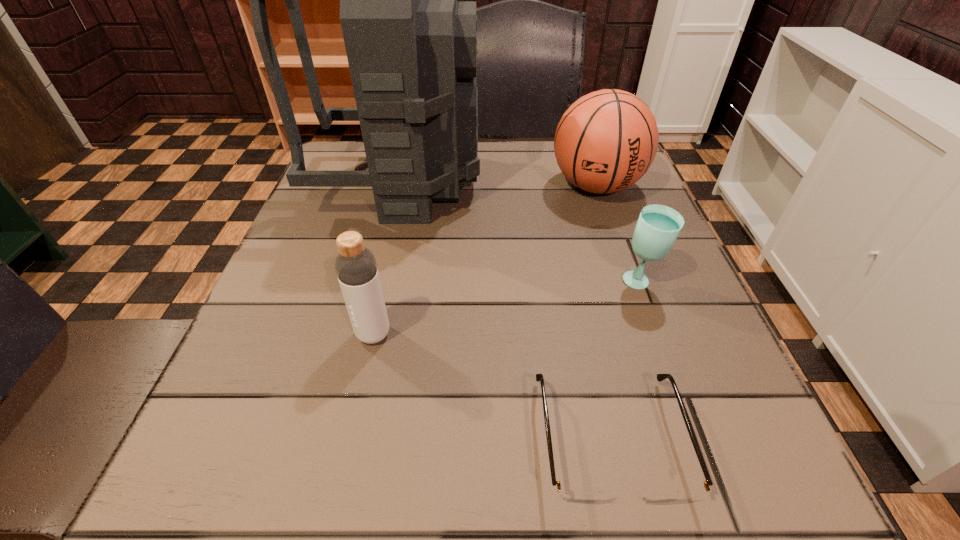
Find the location of `vacant space located 0.140m on the back of the second shortest object`. vacant space located 0.140m on the back of the second shortest object is located at coordinates (618, 222).

You are a GUI agent. You are given a task and a screenshot of the screen. Output one action in this format:
    pyautogui.click(x=<x>, y=<y>)
    Task: Click on the backpack present at the far edge
    The image size is (960, 540).
    Given the screenshot: What is the action you would take?
    pyautogui.click(x=411, y=46)

Locate an element on the screen. The width and height of the screenshot is (960, 540). basketball that is at the far edge is located at coordinates (606, 141).

The height and width of the screenshot is (540, 960). I want to click on object that is at the near edge, so click(575, 495).

In order to click on object that is at the left edge in this screenshot , I will do `click(411, 46)`.

Identify the location of basketball that is at the right edge. (606, 141).

I want to click on glass that is positioned at the right edge, so click(x=658, y=226).

Find the location of a particular element. spectacles at the right edge is located at coordinates (575, 495).

Image resolution: width=960 pixels, height=540 pixels. I want to click on object that is positioned at the far left corner, so [x=411, y=46].

Find the location of `object at the far right corner`. object at the far right corner is located at coordinates (606, 141).